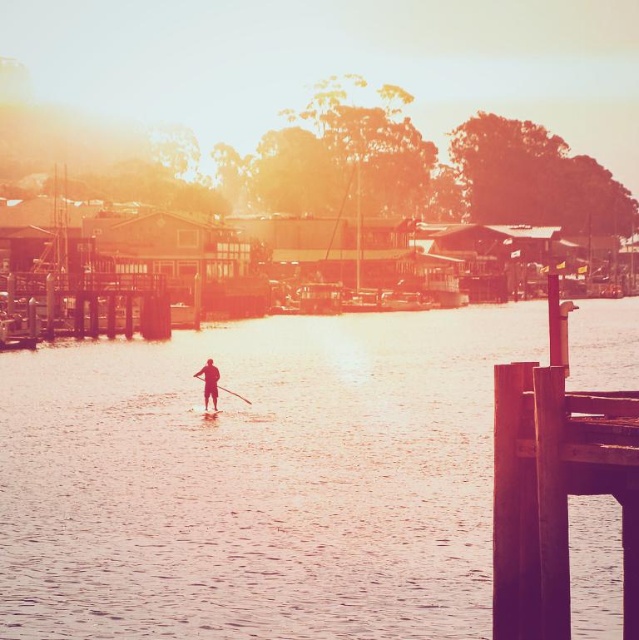
In the scene shown: Is wooden dock at right smaller than smooth skin paddleboarder at center?

No.

Consider the image. Who is shorter, wooden dock at right or smooth skin paddleboarder at center?

smooth skin paddleboarder at center is shorter.

The height and width of the screenshot is (640, 639). What do you see at coordinates (555, 484) in the screenshot?
I see `wooden dock at right` at bounding box center [555, 484].

At what (x,y) coordinates should I click in order to perform the action: click on wooden dock at right. Please return your answer as a coordinate pair (x, y). The height and width of the screenshot is (640, 639). Looking at the image, I should click on (555, 484).

What do you see at coordinates (555, 484) in the screenshot?
I see `wooden dock at right` at bounding box center [555, 484].

Is wooden dock at right in front of wooden canoe at center?

Yes, wooden dock at right is in front of wooden canoe at center.

Which is in front, point (631, 595) or point (204, 406)?

Positioned in front is point (631, 595).

At what (x,y) coordinates should I click in order to perform the action: click on wooden dock at right. Please return your answer as a coordinate pair (x, y). This screenshot has width=639, height=640. Looking at the image, I should click on (555, 484).

Can you confirm if transparent water at center is wider than wooden dock at right?

Correct, the width of transparent water at center exceeds that of wooden dock at right.

Between transparent water at center and wooden dock at right, which one appears on the right side from the viewer's perspective?

wooden dock at right

The image size is (639, 640). What do you see at coordinates (258, 480) in the screenshot?
I see `transparent water at center` at bounding box center [258, 480].

Find the location of `transparent water at center`. transparent water at center is located at coordinates (258, 480).